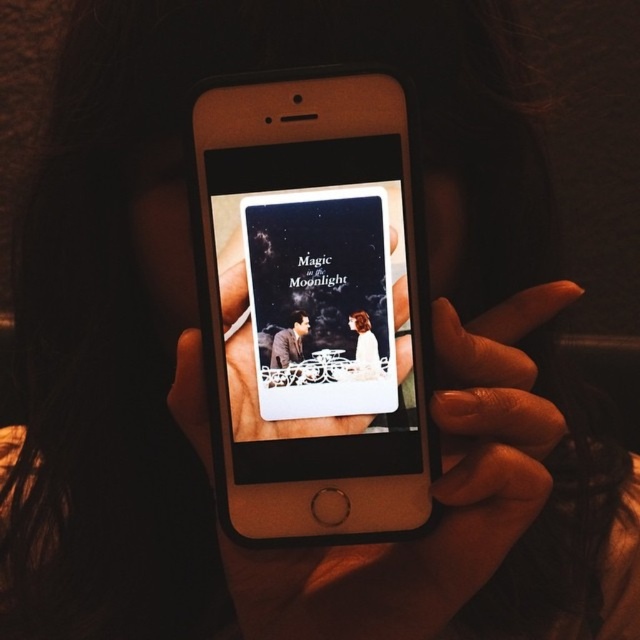
Question: Which point is farther to the camera?

Choices:
 (A) (324, 227)
 (B) (470, 570)

Answer: (A)

Question: Can you confirm if gold metallic smartphone at center is positioned below matte plastic phone at center?

Choices:
 (A) no
 (B) yes

Answer: (B)

Question: Which of the following is the farthest from the observer?

Choices:
 (A) (376, 212)
 (B) (204, 132)
 (C) (273, 593)

Answer: (C)

Question: Does gold metallic smartphone at center appear on the left side of smooth skin hand at center?

Choices:
 (A) no
 (B) yes

Answer: (B)

Question: Does gold metallic smartphone at center appear on the right side of matte plastic phone at center?

Choices:
 (A) no
 (B) yes

Answer: (A)

Question: Which point is farther to the camera?

Choices:
 (A) (380, 429)
 (B) (456, 442)
 (C) (310, 416)

Answer: (B)